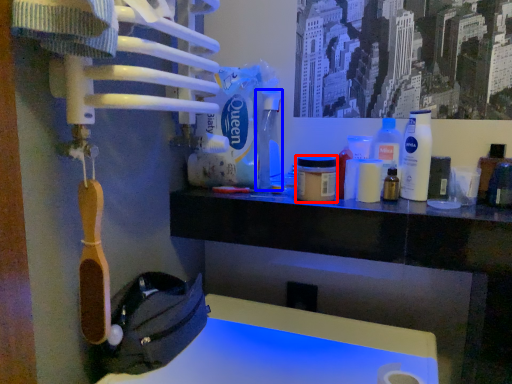
Question: Which of the following is the closest to the observer, mouthwash (highlighted by a red box) or bottle (highlighted by a blue box)?

Choices:
 (A) mouthwash
 (B) bottle

Answer: (A)